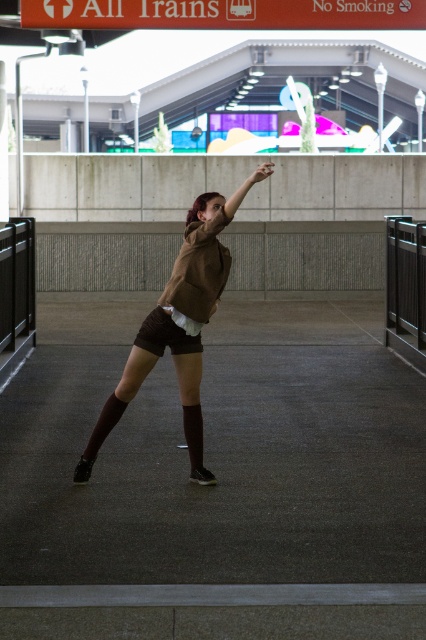
Question: Is matte brown arm at upper center positioned before matte brown sweater at center?

Choices:
 (A) yes
 (B) no

Answer: (A)

Question: In this image, where is brown suede hoodie at center located relative to matte brown arm at upper center?

Choices:
 (A) right
 (B) left

Answer: (B)

Question: Does brown suede hoodie at center appear over matte brown sweater at center?

Choices:
 (A) yes
 (B) no

Answer: (B)

Question: Estimate the real-world distances between objects in this image. Which object is closer to the brown suede hoodie at center?

Choices:
 (A) matte brown arm at upper center
 (B) brown suede shorts at center

Answer: (B)

Question: Estimate the real-world distances between objects in this image. Which object is farther from the brown suede hoodie at center?

Choices:
 (A) matte brown sweater at center
 (B) matte brown arm at upper center

Answer: (B)

Question: Which object appears closest to the camera in this image?

Choices:
 (A) matte brown sweater at center
 (B) brown suede shorts at center

Answer: (B)